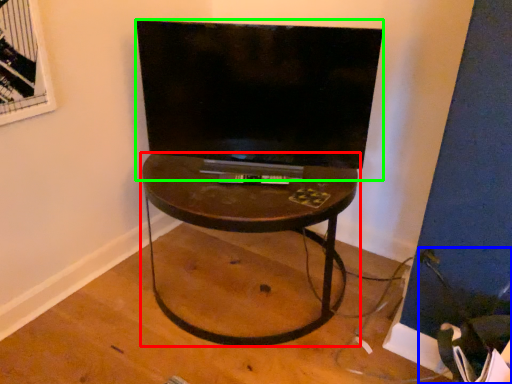
Question: Considering the real-world distances, which object is closest to table (highlighted by a red box)? swivel chair (highlighted by a blue box) or television (highlighted by a green box).

Choices:
 (A) swivel chair
 (B) television

Answer: (B)